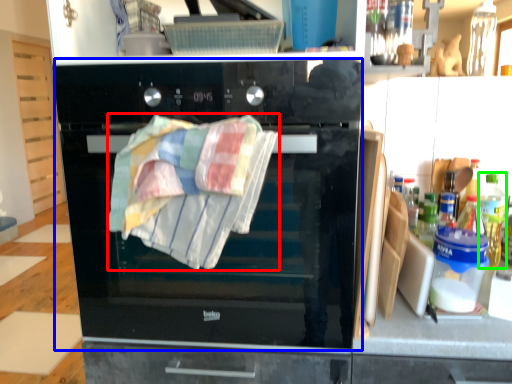
Question: Which object is positioned closest to beach towel (highlighted by a red box)? Select from oven (highlighted by a blue box) and bottle (highlighted by a green box).

Choices:
 (A) oven
 (B) bottle

Answer: (A)